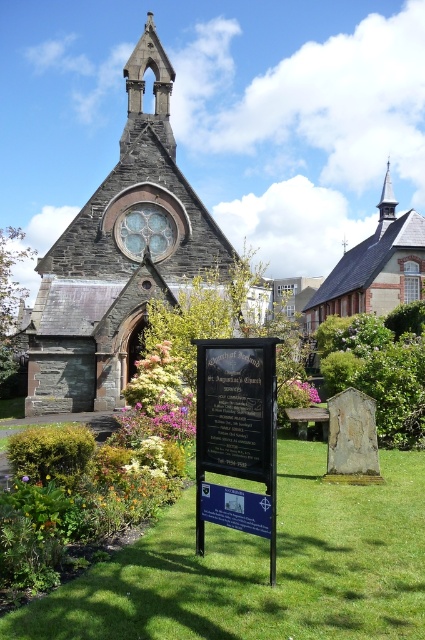
Question: Among these objects, which one is nearest to the camera?

Choices:
 (A) green grass at lower center
 (B) black polished stone sign at center
 (C) purple matte flower at center
 (D) pink matte flower at center

Answer: (A)

Question: Which point is closer to the camera taking this photo?

Choices:
 (A) (362, 634)
 (B) (356, 257)
 (C) (317, 394)
 (D) (70, 221)

Answer: (A)

Question: Is green grass at lower center wider than dark gray stone church at center?

Choices:
 (A) no
 (B) yes

Answer: (B)

Question: From the image, what is the correct spatial relationship of green grass at lower center in relation to dark gray stone church at center?

Choices:
 (A) right
 (B) left

Answer: (A)

Question: Is green grass at lower center below pink matte flower at center?

Choices:
 (A) yes
 (B) no

Answer: (A)

Question: Which is nearer to the purple matte flower at center?

Choices:
 (A) wooden shingles chapel at upper right
 (B) black polished stone sign at center
 (C) pink matte flower at center

Answer: (B)